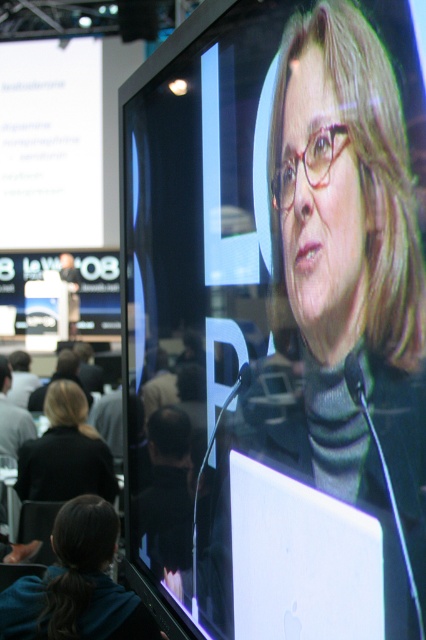
You are an attendee at this conference and want to take a photo of the white glossy laptop at center and the blonde hair at lower left. Which object should you focus on first if you want to capture both in the same frame?

The white glossy laptop at center is located above blonde hair at lower left, so you should focus on the white glossy laptop at center first to ensure both are in the same frame.

You are an attendee at this conference. You need to place a 10cm tall note on the white glossy laptop at center without blocking the blonde hair at lower left. Is this possible?

The white glossy laptop at center is much taller than the blonde hair at lower left, so placing a 10cm tall note on the white glossy laptop at center won